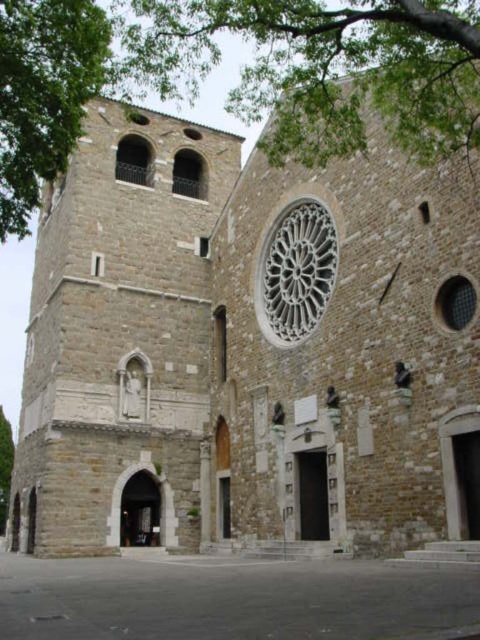
Question: Which point is closer to the camera?

Choices:
 (A) green leafy tree at upper center
 (B) white stone rose window at center
 (C) green leafy tree at upper left
 (D) green leafy tree at left

Answer: (A)

Question: Does green leafy tree at upper left come behind white stone rose window at center?

Choices:
 (A) no
 (B) yes

Answer: (A)

Question: Does green leafy tree at upper center come behind white stone rose window at center?

Choices:
 (A) yes
 (B) no

Answer: (B)

Question: Does green leafy tree at upper center appear on the left side of green leafy tree at upper left?

Choices:
 (A) yes
 (B) no

Answer: (B)

Question: Which point is closer to the camera?

Choices:
 (A) green leafy tree at upper left
 (B) white stone rose window at center

Answer: (A)

Question: Estimate the real-world distances between objects in this image. Which object is farther from the green leafy tree at upper center?

Choices:
 (A) white stone rose window at center
 (B) green leafy tree at left

Answer: (B)